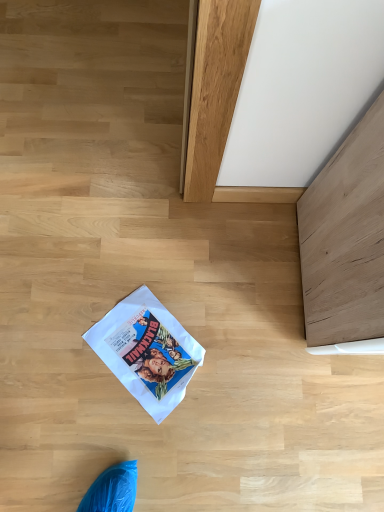
Where is `unoccupied space behind white paper at center`? Image resolution: width=384 pixels, height=512 pixels. unoccupied space behind white paper at center is located at coordinates (170, 268).